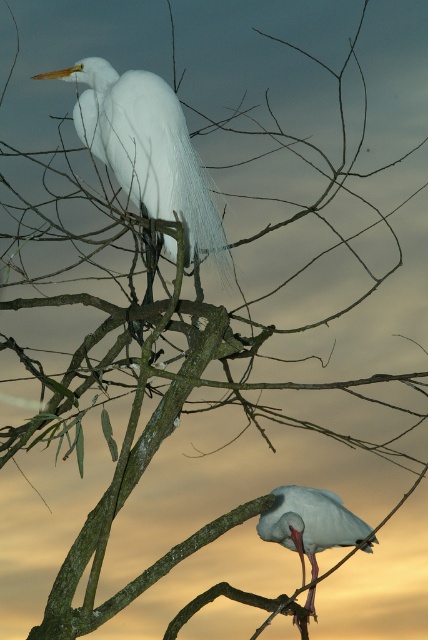
You are an ornithologist observing two birds in the scene. The matte white egret at upper center and the white matte bird at lower right. Which bird has a taller height?

The matte white egret at upper center has a greater height compared to the white matte bird at lower right.

You are an ornithologist observing two white birds in a tree. You notice a specific point at coordinates (146,148). Which bird is this point located on?

The point at coordinates (146,148) is located on the matte white egret at upper center.

You are a birdwatcher observing the two white birds in the scene. Which bird is located higher up in the tree, the matte white egret at upper center or the white matte bird at lower right?

The matte white egret at upper center is positioned over the white matte bird at lower right, so it is higher up in the tree.